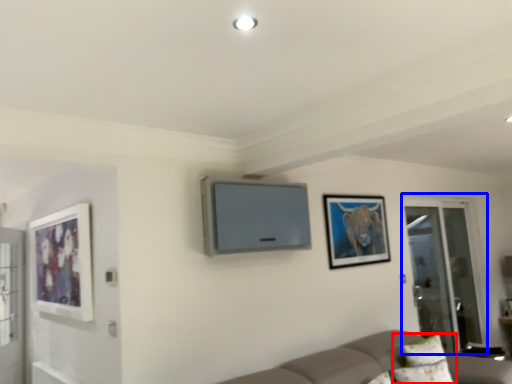
Question: Which point is further to the camera, pillow (highlighted by a red box) or screen door (highlighted by a blue box)?

Choices:
 (A) pillow
 (B) screen door

Answer: (B)